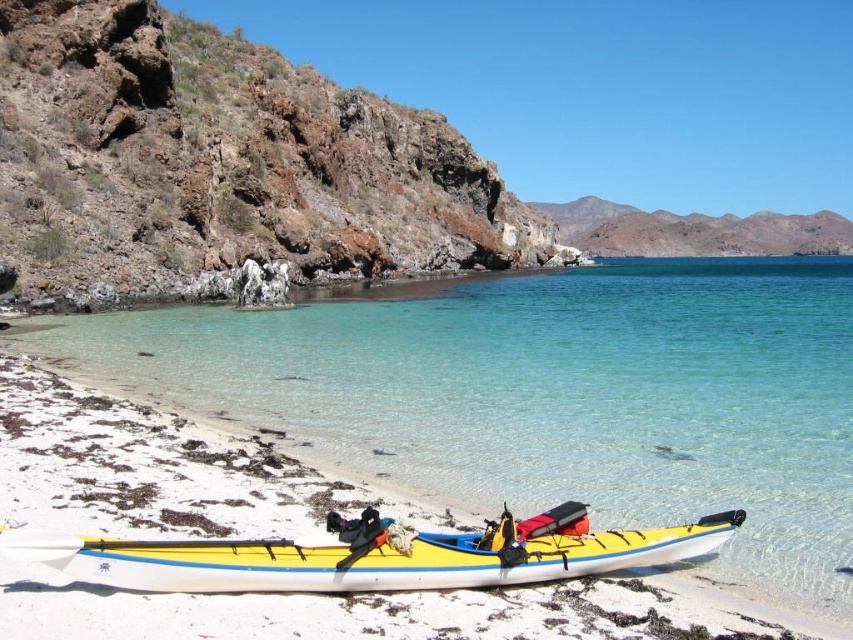
Question: Which point is farther from the camera taking this photo?

Choices:
 (A) (508, 248)
 (B) (766, 593)
 (C) (553, 554)

Answer: (A)

Question: Based on their relative distances, which object is nearer to the yellow matte kayak at lower center?

Choices:
 (A) clear water at lower center
 (B) rusty rock at upper left

Answer: (A)

Question: Which of the following is the farthest from the observer?

Choices:
 (A) clear water at lower center
 (B) rusty rock at upper left
 (C) yellow matte kayak at lower center

Answer: (B)

Question: Does clear water at lower center appear on the left side of yellow matte kayak at lower center?

Choices:
 (A) no
 (B) yes

Answer: (A)

Question: Is clear water at lower center thinner than rusty rock at upper left?

Choices:
 (A) no
 (B) yes

Answer: (A)

Question: Can you confirm if clear water at lower center is positioned to the right of yellow matte kayak at lower center?

Choices:
 (A) no
 (B) yes

Answer: (B)